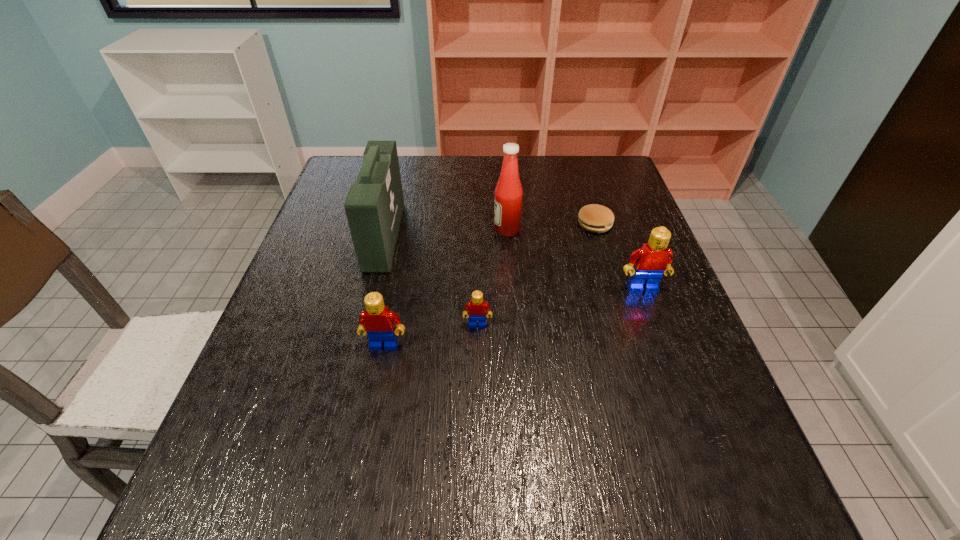
Identify the location of spot to insert another Lego for uniform distribution. click(564, 306).